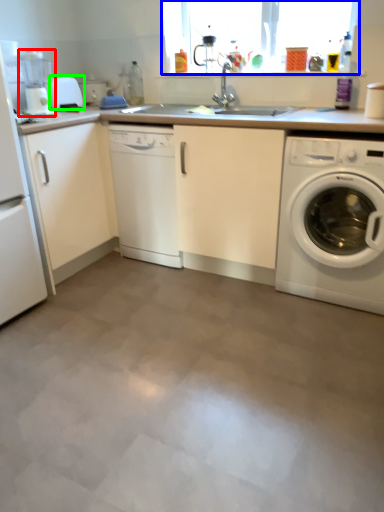
Question: Estimate the real-world distances between objects in this image. Which object is closer to coffee machine (highlighted by a red box), window screen (highlighted by a blue box) or appliance (highlighted by a green box)?

Choices:
 (A) window screen
 (B) appliance

Answer: (B)